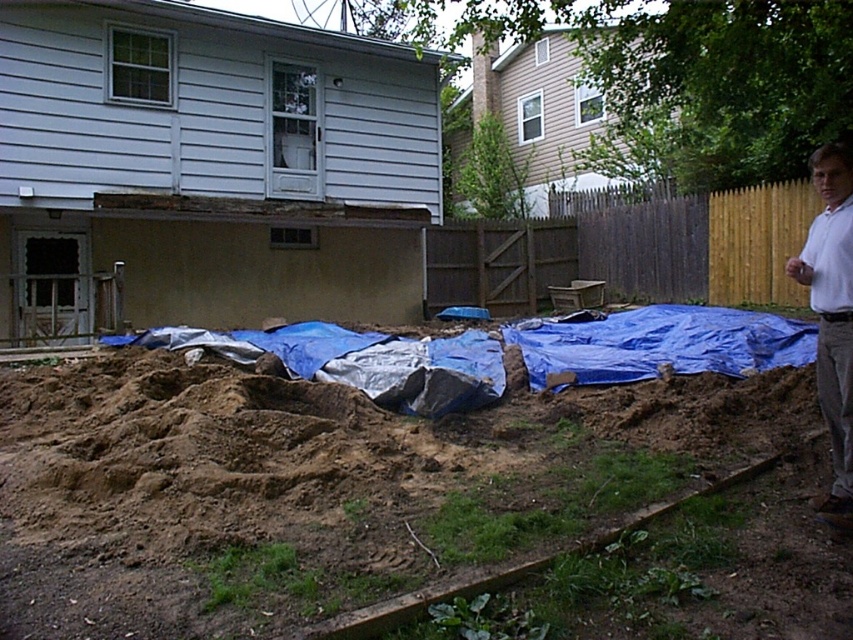
Question: Can you confirm if brown soil at lower left is positioned to the left of white cotton shirt at right?

Choices:
 (A) no
 (B) yes

Answer: (B)

Question: Is brown soil at lower left further to camera compared to white cotton shirt at right?

Choices:
 (A) yes
 (B) no

Answer: (A)

Question: Which point is closer to the camera?

Choices:
 (A) white cotton shirt at right
 (B) brown soil at lower left

Answer: (A)

Question: Does brown soil at lower left appear on the right side of white cotton shirt at right?

Choices:
 (A) no
 (B) yes

Answer: (A)

Question: Which point is closer to the camera?

Choices:
 (A) brown soil at lower left
 (B) white cotton shirt at right

Answer: (B)